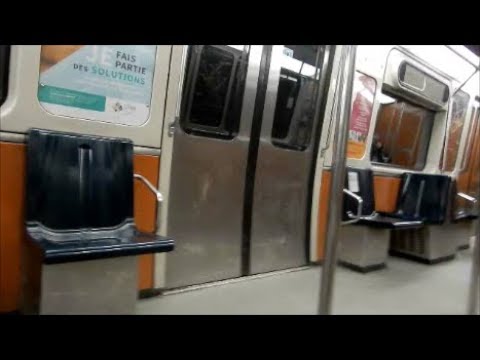
Identify the location of floor. (415, 302).